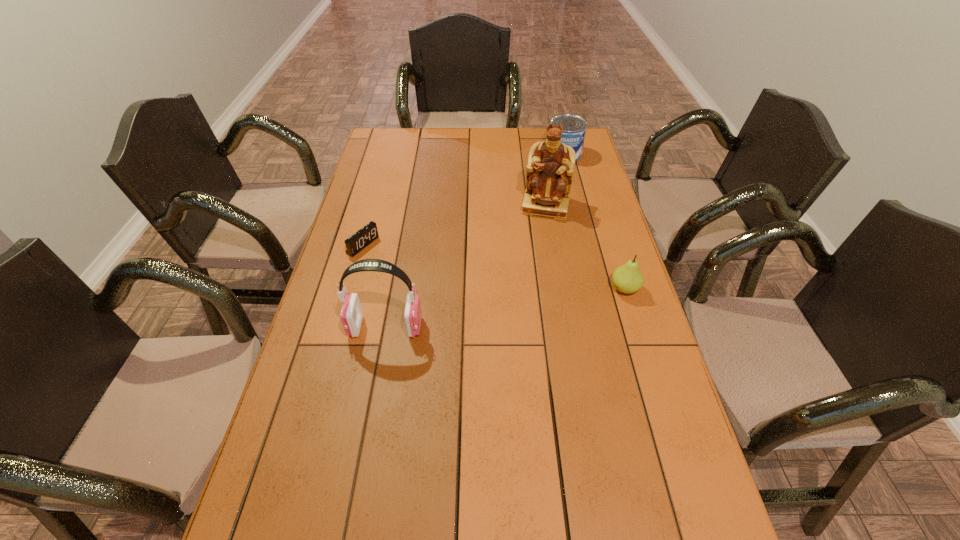
The image size is (960, 540). Find the location of `object that is the third closest to the figurine`. object that is the third closest to the figurine is located at coordinates (362, 238).

The image size is (960, 540). In order to click on the third closest object to the farthest object in this screenshot , I will do `click(362, 238)`.

The image size is (960, 540). In order to click on free location that satisfies the following two spatial constraints: 1. on the front side of the second tallest object; 2. on the outer surface of the third nearest object in this screenshot , I will do `click(340, 327)`.